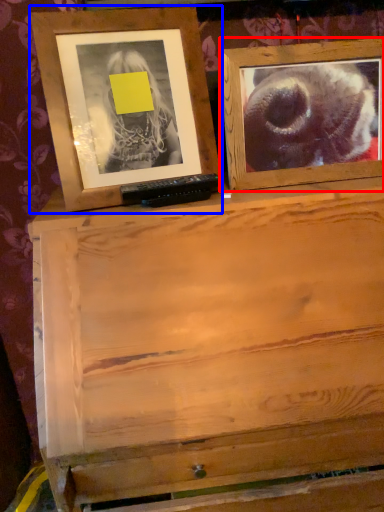
Question: Which object appears closest to the camera in this image, picture frame (highlighted by a red box) or picture frame (highlighted by a blue box)?

Choices:
 (A) picture frame
 (B) picture frame

Answer: (B)